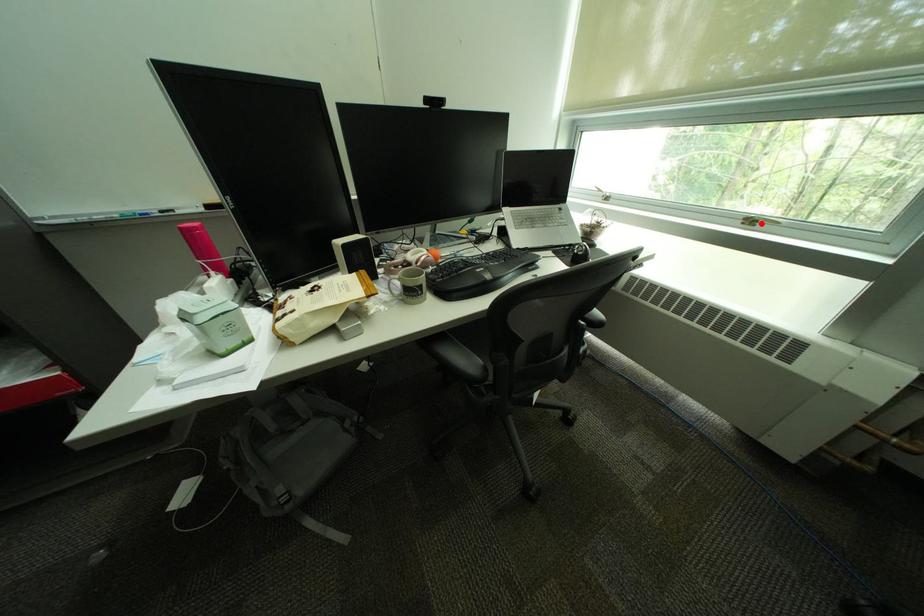
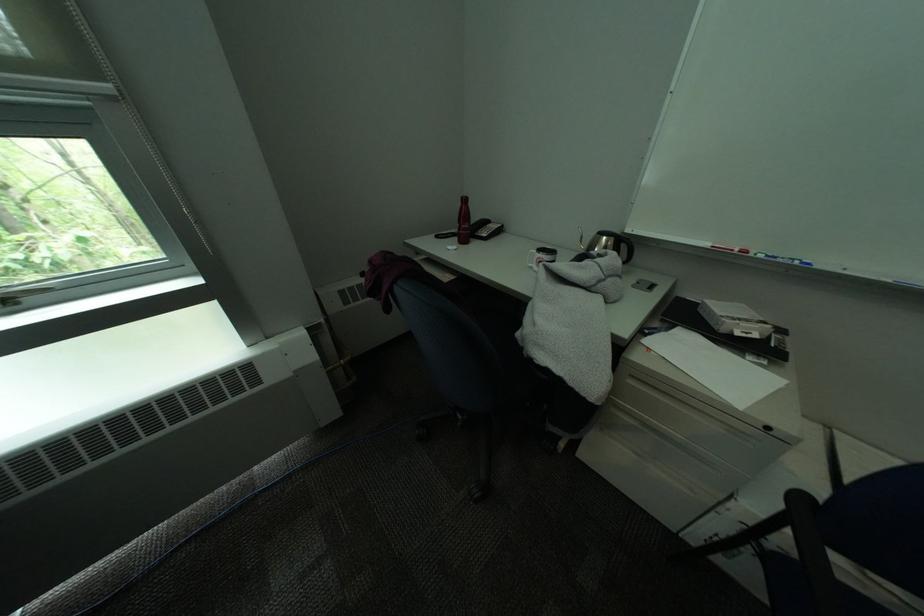
Question: I am providing you with two images of the same scene from different viewpoints. A red point is marked on the first image. Is the red point's position out of view in image 2?

Choices:
 (A) Yes
 (B) No

Answer: (B)